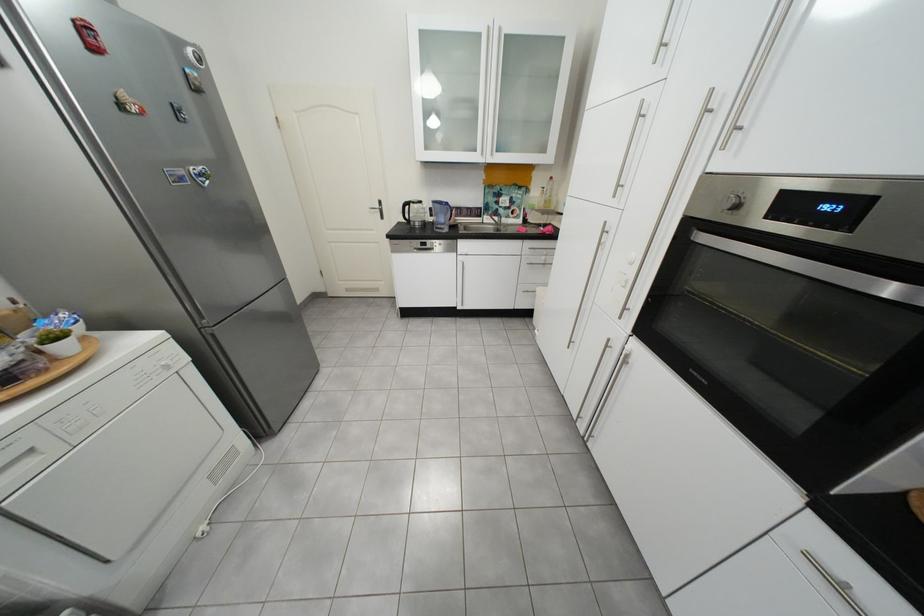
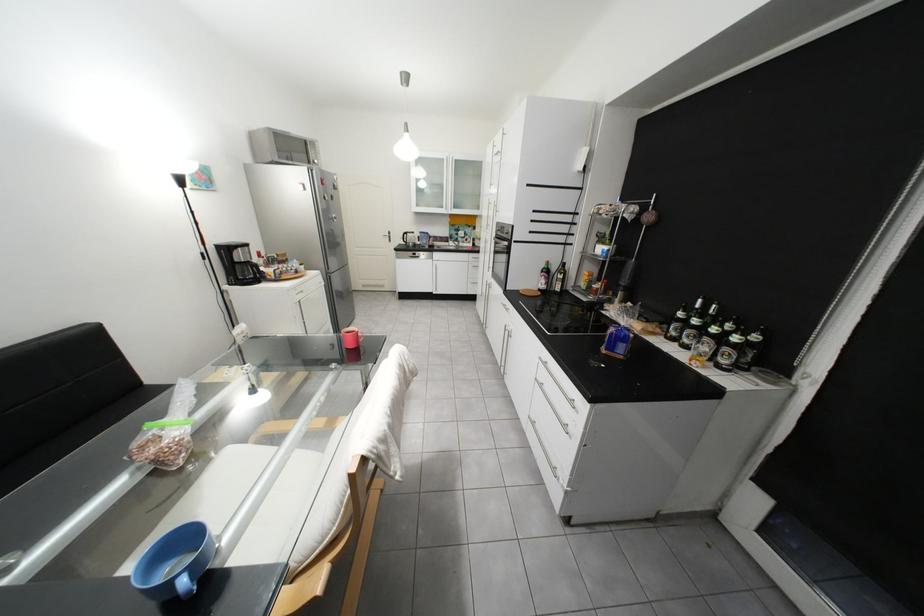
In the second image, find the point that corresponds to [457,230] in the first image.

(439, 248)